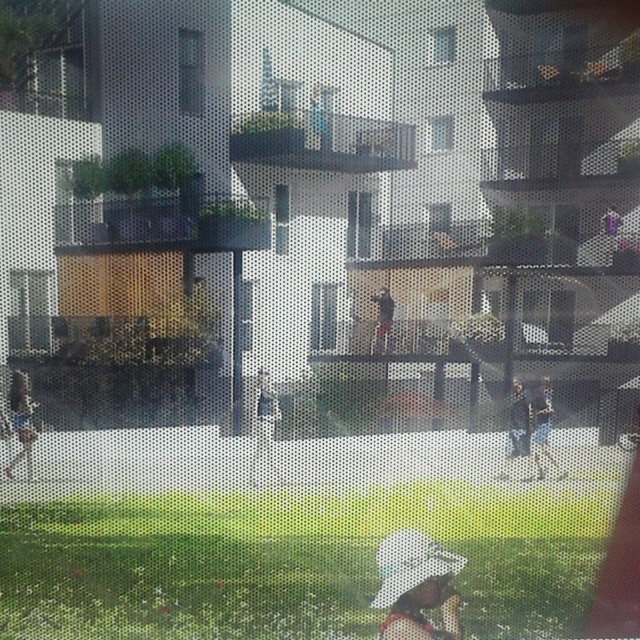
Which of these two, green grass at lower center or dark gray fabric jacket at center, stands shorter?

With less height is dark gray fabric jacket at center.

Which is above, green grass at lower center or dark gray fabric jacket at center?

Positioned higher is dark gray fabric jacket at center.

The image size is (640, 640). I want to click on green grass at lower center, so click(x=291, y=561).

The width and height of the screenshot is (640, 640). In order to click on green grass at lower center in this screenshot , I will do `click(291, 561)`.

Consider the image. Can you confirm if white cotton shirt at lower left is bigger than dark gray fabric jacket at center?

Indeed, white cotton shirt at lower left has a larger size compared to dark gray fabric jacket at center.

Is white cotton shirt at lower left thinner than dark gray fabric jacket at center?

No, white cotton shirt at lower left is not thinner than dark gray fabric jacket at center.

What do you see at coordinates (20, 420) in the screenshot? I see `white cotton shirt at lower left` at bounding box center [20, 420].

Locate an element on the screen. This screenshot has height=640, width=640. white cotton shirt at lower left is located at coordinates (20, 420).

Looking at this image, between green grass at lower center and light blue denim jeans at lower right, which one appears on the right side from the viewer's perspective?

Positioned to the right is light blue denim jeans at lower right.

Which of these two, green grass at lower center or light blue denim jeans at lower right, stands shorter?

Standing shorter between the two is light blue denim jeans at lower right.

Who is more forward, (531, 604) or (531, 419)?

Point (531, 604)

Locate an element on the screen. The height and width of the screenshot is (640, 640). green grass at lower center is located at coordinates (291, 561).